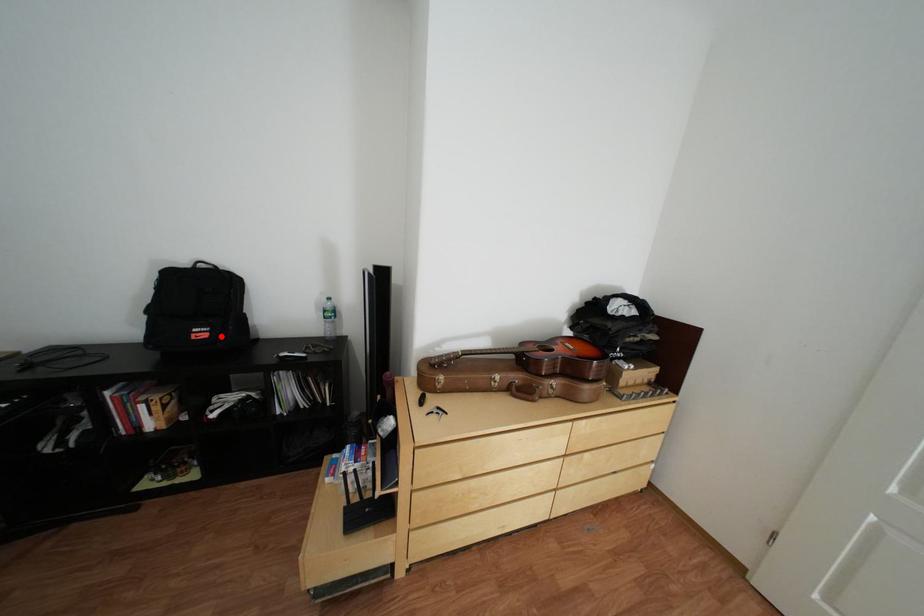
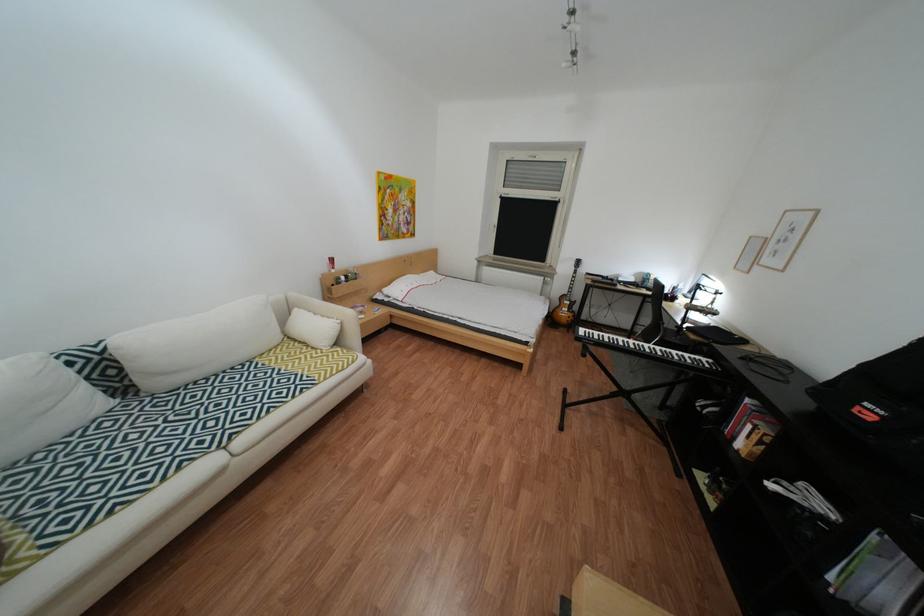
Question: I am providing you with two images of the same scene from different viewpoints. In image1, a red point is highlighted. Considering the same 3D point in image2, which of the following is correct?

Choices:
 (A) It is closer
 (B) It is farther

Answer: (B)